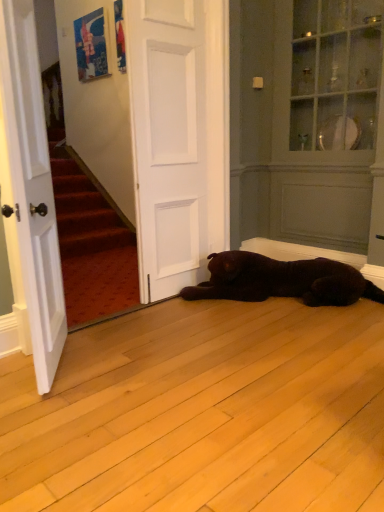
Question: Can you confirm if white matte door at center, positioned as the 1th door in right-to-left order, is positioned to the right of white wood door at left, which appears as the 2th door when viewed from the back?

Choices:
 (A) no
 (B) yes

Answer: (B)

Question: Are white matte door at center, which is counted as the second door, starting from the front, and white wood door at left, the 2th door from the right, beside each other?

Choices:
 (A) no
 (B) yes

Answer: (A)

Question: From a real-world perspective, is white matte door at center, which is counted as the second door, starting from the front, below white wood door at left, which appears as the first door when viewed from the left?

Choices:
 (A) yes
 (B) no

Answer: (B)

Question: Is white matte door at center, positioned as the 1th door in right-to-left order, aimed at white wood door at left, the first door from the front?

Choices:
 (A) yes
 (B) no

Answer: (B)

Question: Can you confirm if white matte door at center, which is the 1th door from back to front, is smaller than white wood door at left, the first door from the front?

Choices:
 (A) no
 (B) yes

Answer: (B)

Question: Does point (46, 193) appear closer or farther from the camera than point (142, 272)?

Choices:
 (A) farther
 (B) closer

Answer: (B)

Question: From a real-world perspective, is white wood door at left, which appears as the 2th door when viewed from the back, positioned above or below white matte door at center, which is counted as the second door, starting from the front?

Choices:
 (A) below
 (B) above

Answer: (A)

Question: Visually, is white wood door at left, the 2th door from the right, positioned to the left or to the right of white matte door at center, which is the 1th door from back to front?

Choices:
 (A) left
 (B) right

Answer: (A)

Question: Relative to white matte door at center, which is the 1th door from back to front, is white wood door at left, the first door from the front, in front or behind?

Choices:
 (A) behind
 (B) front

Answer: (B)

Question: In the image, is white matte door at center, which is the 1th door from back to front, on the left side or the right side of white wood door at left, the first door from the front?

Choices:
 (A) right
 (B) left

Answer: (A)

Question: Is white matte door at center, positioned as the 1th door in right-to-left order, inside or outside of white wood door at left, which appears as the first door when viewed from the left?

Choices:
 (A) inside
 (B) outside

Answer: (B)

Question: Is point (142, 3) closer or farther from the camera than point (31, 236)?

Choices:
 (A) farther
 (B) closer

Answer: (A)

Question: In terms of width, does white matte door at center, which is the 1th door from back to front, look wider or thinner when compared to white wood door at left, the first door from the front?

Choices:
 (A) wide
 (B) thin

Answer: (B)

Question: Does point (360, 211) appear closer or farther from the camera than point (173, 67)?

Choices:
 (A) farther
 (B) closer

Answer: (A)

Question: In terms of size, does matte white armoire at upper right appear bigger or smaller than white matte door at center, which is counted as the second door, starting from the front?

Choices:
 (A) small
 (B) big

Answer: (B)